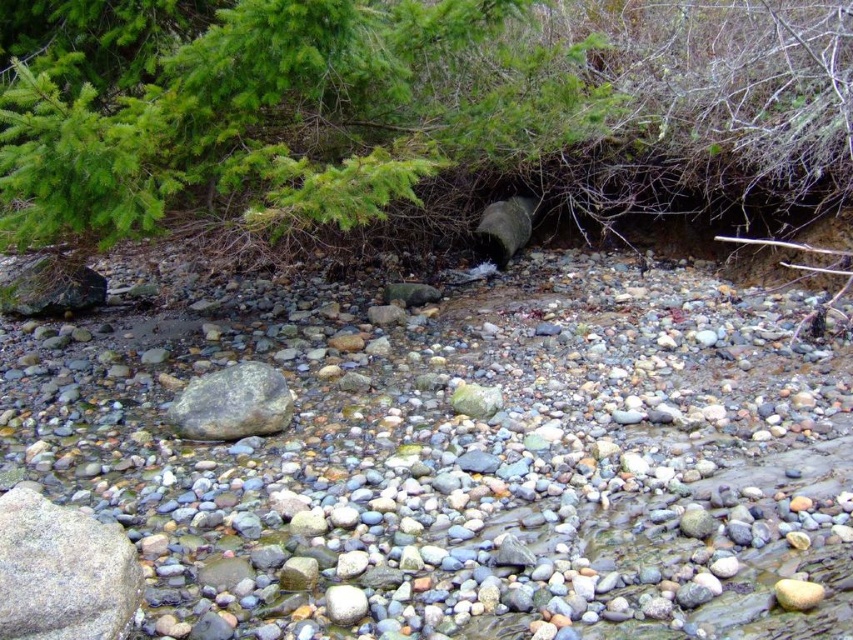
You are standing at the edge of the riverbed and notice the smooth gray rock at center and the green matte tree at upper center. Which object is closer to the ground?

The smooth gray rock at center is closer to the ground because it is below the green matte tree at upper center.

You are standing at the origin point of the riverbed. You want to find the smooth gray rock at center. Which direction should you move to reach it?

The smooth gray rock at center is located at coordinates point (461,458), so you should move towards the right and forward to reach it.

You are a geologist examining the riverbed. You notice two rocks labeled as smooth gray rock at center and gray smooth rock at center. Which one is positioned higher up in the image?

The smooth gray rock at center is positioned higher up than the gray smooth rock at center.